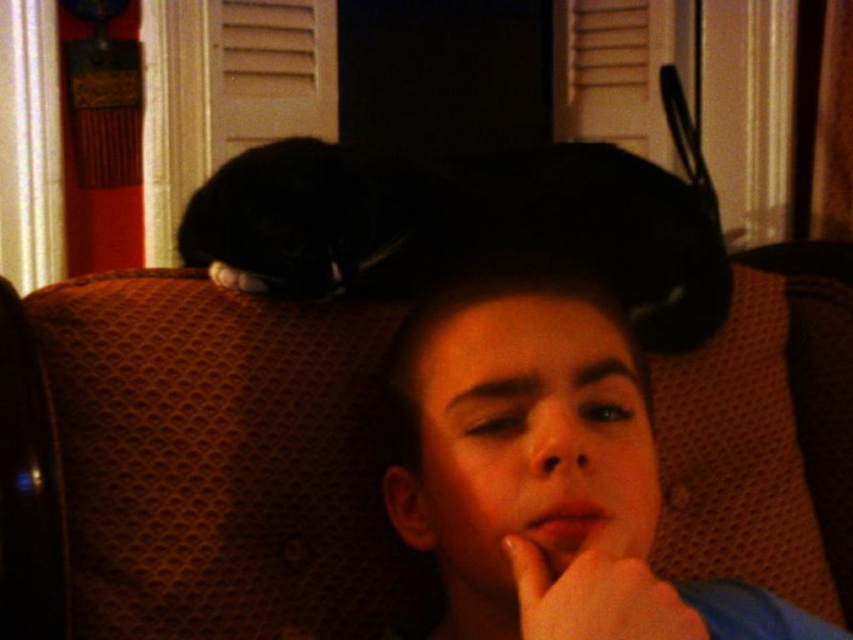
You are a photographer trying to capture a clear shot of the smooth skin face at center and the black fur cat at upper center. Which one will appear closer to the camera in the photo?

The smooth skin face at center will appear closer to the camera because it is in front of the black fur cat at upper center.

You are taking a photo of the scene and want to focus on both the point at (325, 234) and the point at (643, 602). Which point should you focus on first to ensure both are in focus?

You should focus on point (325, 234) first because it is closer to the camera than point (643, 602). This way, adjusting the focus from the closer point outward will help both points come into focus.